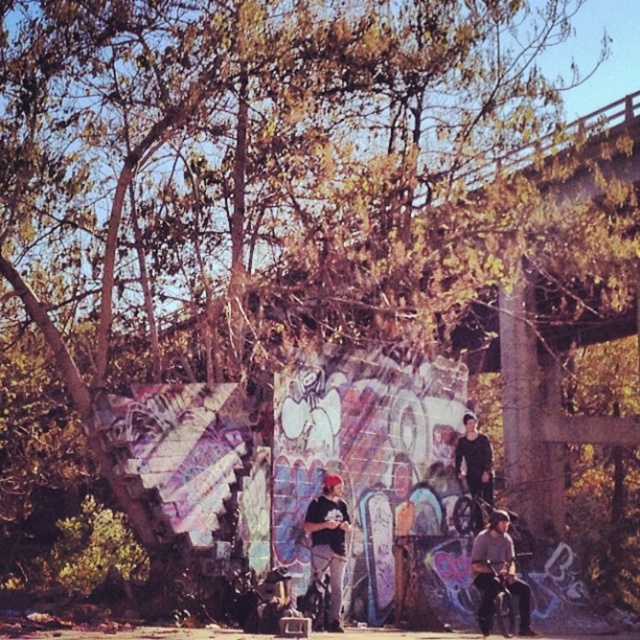
Question: Does denim jacket at lower right come in front of matte black cap at center?

Choices:
 (A) no
 (B) yes

Answer: (B)

Question: Is denim jacket at lower right bigger than matte black cap at center?

Choices:
 (A) no
 (B) yes

Answer: (B)

Question: Can you confirm if denim jacket at lower right is positioned below matte black cap at center?

Choices:
 (A) no
 (B) yes

Answer: (B)

Question: Which point appears closest to the camera in this image?

Choices:
 (A) (529, 634)
 (B) (330, 550)

Answer: (B)